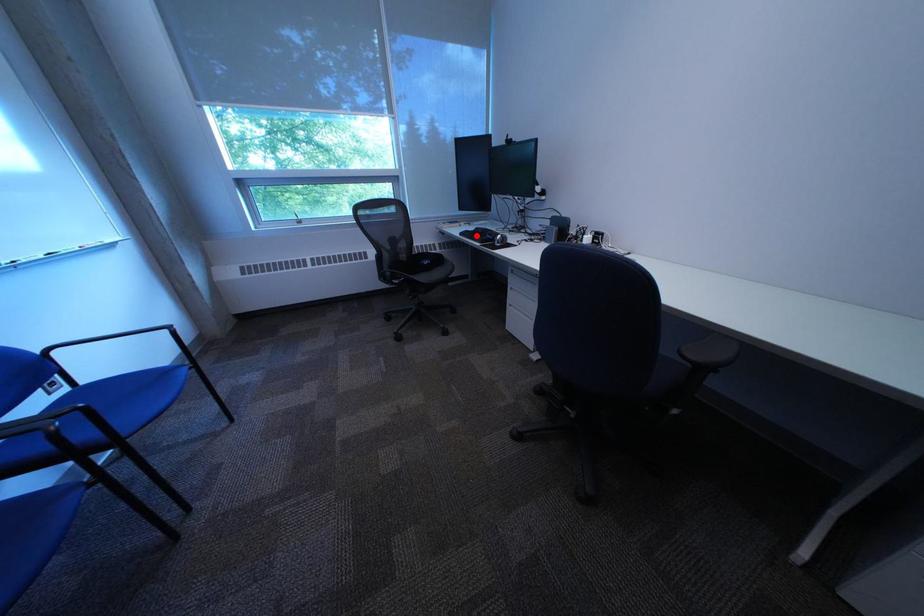
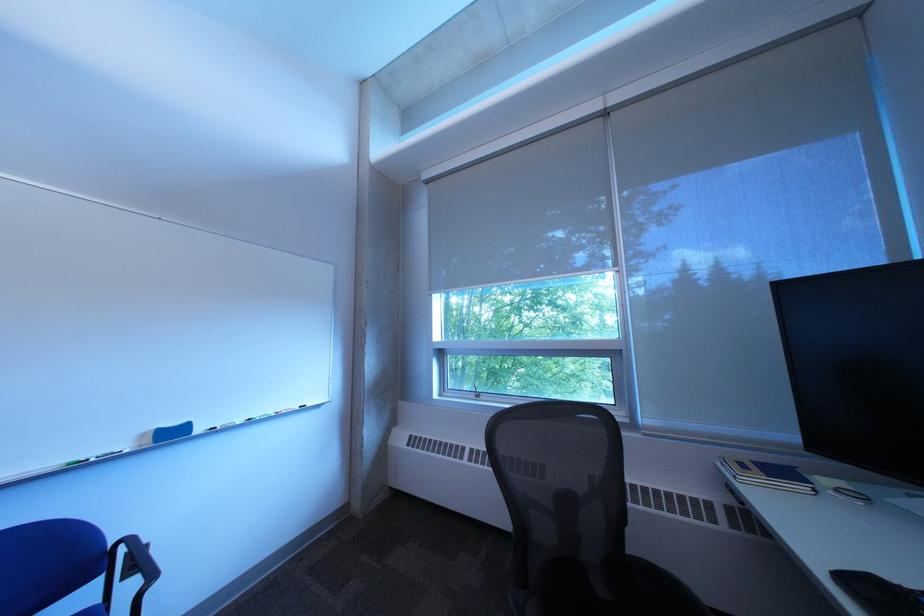
The point at the highlighted location is marked in the first image. Where is the corresponding point in the second image?

(860, 582)